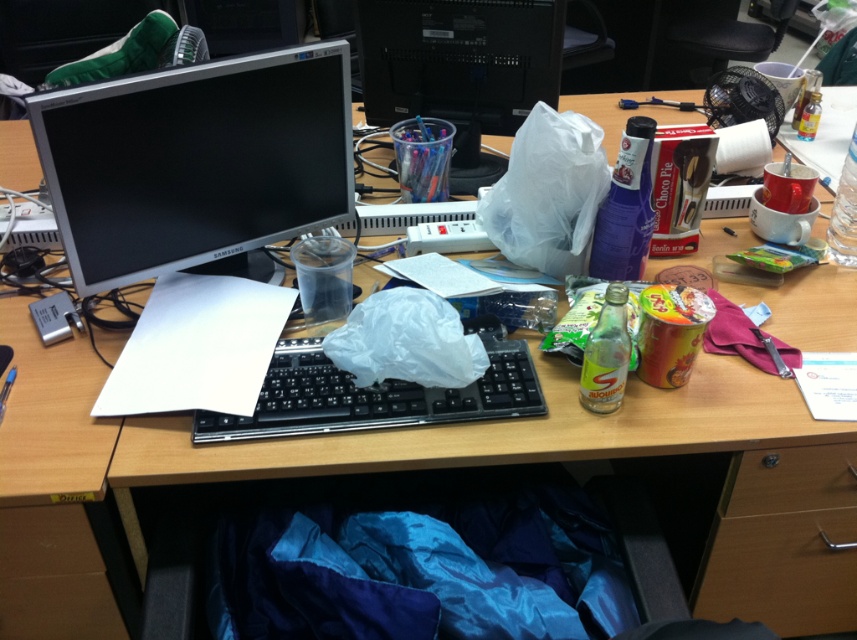
Does point (496, 1) come closer to viewer compared to point (772, 618)?

No, it is behind (772, 618).

Which is behind, point (369, 113) or point (817, 474)?

Point (369, 113)

The height and width of the screenshot is (640, 857). What do you see at coordinates (460, 68) in the screenshot?
I see `transparent plastic cup at upper center` at bounding box center [460, 68].

Identify the location of transparent plastic cup at upper center. Image resolution: width=857 pixels, height=640 pixels. (460, 68).

Can you confirm if satin silver monitor at upper left is positioned below transparent plastic cup at upper center?

Yes, satin silver monitor at upper left is below transparent plastic cup at upper center.

Who is more forward, (x=220, y=148) or (x=366, y=60)?

Point (x=220, y=148)

Where is `satin silver monitor at upper left`? The width and height of the screenshot is (857, 640). satin silver monitor at upper left is located at coordinates (195, 161).

Is wooden drawer at lower center below black plastic keyboard at center?

Yes.

Who is more forward, (788, 492) or (303, 413)?

Point (303, 413) is in front.

You are a GUI agent. You are given a task and a screenshot of the screen. Output one action in this format:
    pyautogui.click(x=<x>, y=<y>)
    Task: Click on the wooden drawer at lower center
    The width and height of the screenshot is (857, 640).
    Given the screenshot: What is the action you would take?
    pyautogui.click(x=783, y=541)